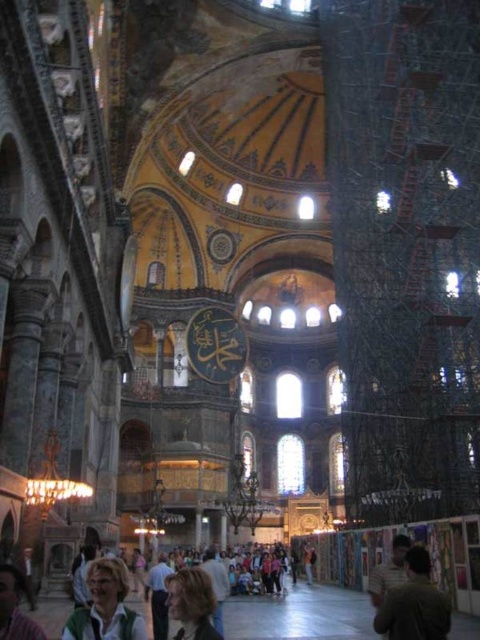
Is point (425, 570) positioned after point (76, 618)?

Yes, it is behind point (76, 618).

Does dark green fabric at lower right have a smaller size compared to green fabric jacket at lower left?

Correct, dark green fabric at lower right occupies less space than green fabric jacket at lower left.

Does point (427, 628) come in front of point (98, 618)?

No.

Where is `dark green fabric at lower right`? The width and height of the screenshot is (480, 640). dark green fabric at lower right is located at coordinates (414, 604).

Describe the element at coordinates (414, 604) in the screenshot. The width and height of the screenshot is (480, 640). I see `dark green fabric at lower right` at that location.

You are a GUI agent. You are given a task and a screenshot of the screen. Output one action in this format:
    pyautogui.click(x=<x>, y=<y>)
    Task: Click on the dark green fabric at lower right
    This screenshot has height=640, width=480.
    Given the screenshot: What is the action you would take?
    pyautogui.click(x=414, y=604)

Which is behind, point (414, 609) or point (20, 577)?

The point (414, 609) is more distant.

This screenshot has height=640, width=480. Find the location of `dark green fabric at lower right`. dark green fabric at lower right is located at coordinates (414, 604).

Between dark green fabric at lower right and blonde hair at center, which one has more height?

With more height is blonde hair at center.

Describe the element at coordinates (414, 604) in the screenshot. I see `dark green fabric at lower right` at that location.

Who is more forward, (394, 595) or (203, 628)?

Positioned in front is point (203, 628).

The image size is (480, 640). In order to click on dark green fabric at lower right in this screenshot , I will do `click(414, 604)`.